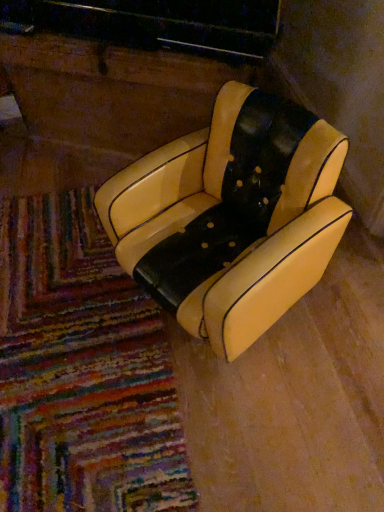
The height and width of the screenshot is (512, 384). I want to click on vacant space in front of yellow leather armchair at center, so click(284, 423).